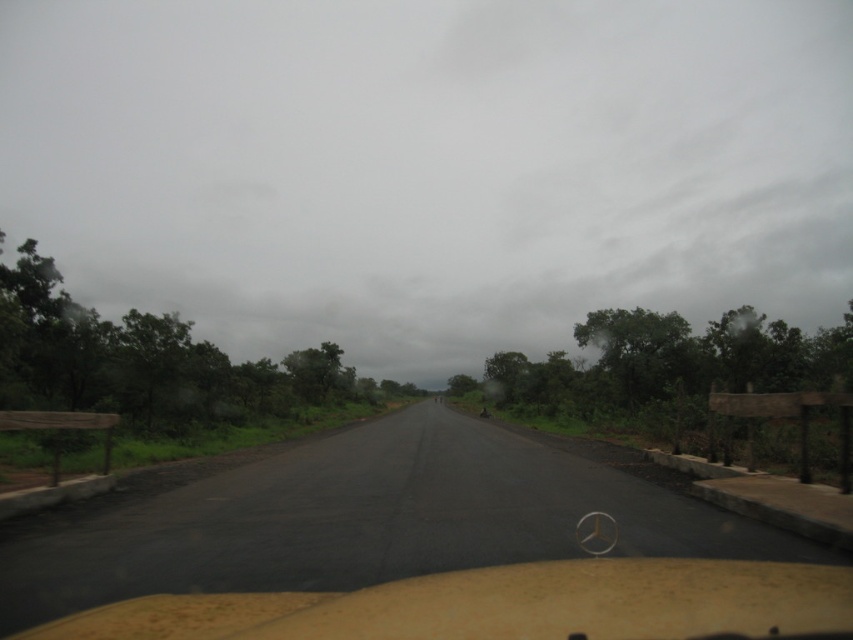
Question: Can you confirm if gray cloudy sky at upper center is smaller than green leafy tree at left?

Choices:
 (A) yes
 (B) no

Answer: (B)

Question: Does yellow matte dashboard at center have a lesser width compared to green leafy tree at left?

Choices:
 (A) yes
 (B) no

Answer: (A)

Question: Estimate the real-world distances between objects in this image. Which object is closer to the green leafy tree at left?

Choices:
 (A) yellow matte dashboard at center
 (B) gray cloudy sky at upper center

Answer: (A)

Question: Which point is farther to the camera?

Choices:
 (A) gray cloudy sky at upper center
 (B) green leafy tree at left
 (C) yellow matte dashboard at center

Answer: (A)

Question: Which is nearer to the gray cloudy sky at upper center?

Choices:
 (A) yellow matte dashboard at center
 (B) green leafy tree at left

Answer: (B)

Question: Is gray cloudy sky at upper center thinner than yellow matte dashboard at center?

Choices:
 (A) yes
 (B) no

Answer: (B)